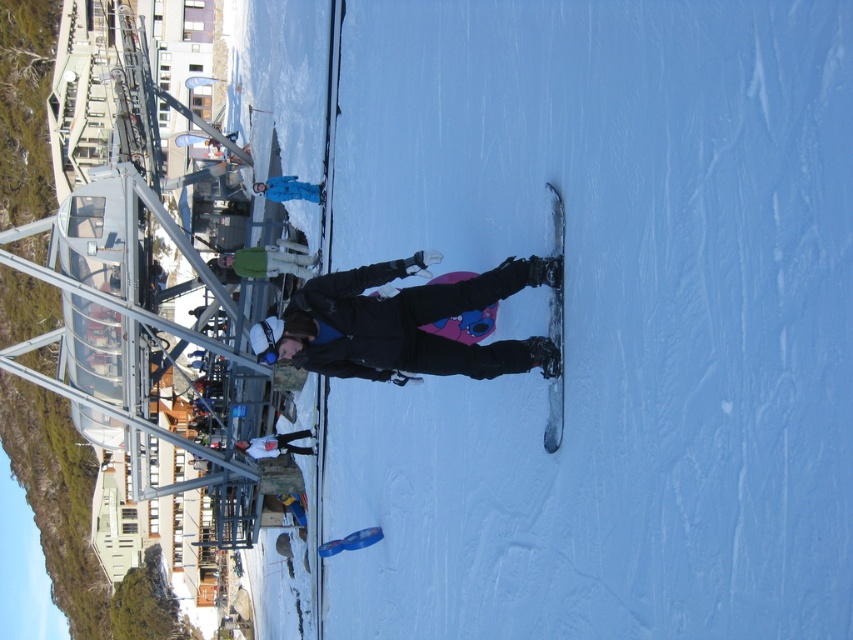
Identify the location of green fabric jacket at center. This screenshot has height=640, width=853. (263, 262).

Is green fabric jacket at center wider than blue snowsuit at center?

Yes.

Locate an element on the screen. The image size is (853, 640). green fabric jacket at center is located at coordinates (263, 262).

Which is behind, point (560, 259) or point (289, 257)?

The point (289, 257) is more distant.

Between metallic gray snowboard at center and green fabric jacket at center, which one has more height?

Answer: With more height is green fabric jacket at center.

Find the location of a particular element. This screenshot has height=640, width=853. metallic gray snowboard at center is located at coordinates (556, 376).

Between metallic gray snowboard at center and blue snowsuit at center, which one appears on the left side from the viewer's perspective?

From the viewer's perspective, blue snowsuit at center appears more on the left side.

Which is behind, point (550, 445) or point (320, 189)?

The point (320, 189) is more distant.

Is point (554, 387) positioned after point (258, 188)?

No, (554, 387) is closer to viewer.

Image resolution: width=853 pixels, height=640 pixels. In order to click on metallic gray snowboard at center in this screenshot , I will do `click(556, 376)`.